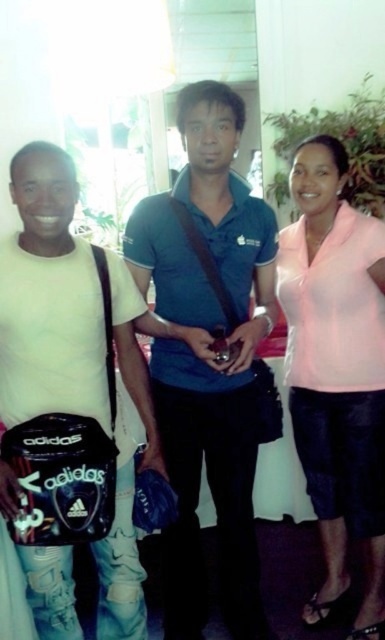
Consider the image. You are trying to decide whether to place a small decorative item on either the blue cotton polo shirt at center or the black matte adidas bag at left. Which surface would be more stable for the item based on their heights?

The blue cotton polo shirt at center has a greater height compared to the black matte adidas bag at left, so placing the item on the blue cotton polo shirt at center would provide a more stable surface since it is taller and less likely to tip over.

You are a photographer trying to capture a photo of the pink matte shirt at right without the black matte adidas bag at left blocking it. Can you move the camera to the side to avoid the bag?

The black matte adidas bag at left is in front of the pink matte shirt at right, so moving the camera to the side might allow you to see around the bag and capture the pink matte shirt at right without obstruction.

Based on the photo, you are a photographer trying to capture a group photo of the people in the scene. You need to ensure that both the black matte adidas bag at left and the pink matte shirt at right are visible in the frame. Based on their positions, which side of the frame should you focus on to include both objects?

To include both the black matte adidas bag at left and the pink matte shirt at right in the frame, focus on the center of the frame since the black matte adidas bag at left is positioned on the left side of the pink matte shirt at right, meaning they are aligned horizontally.